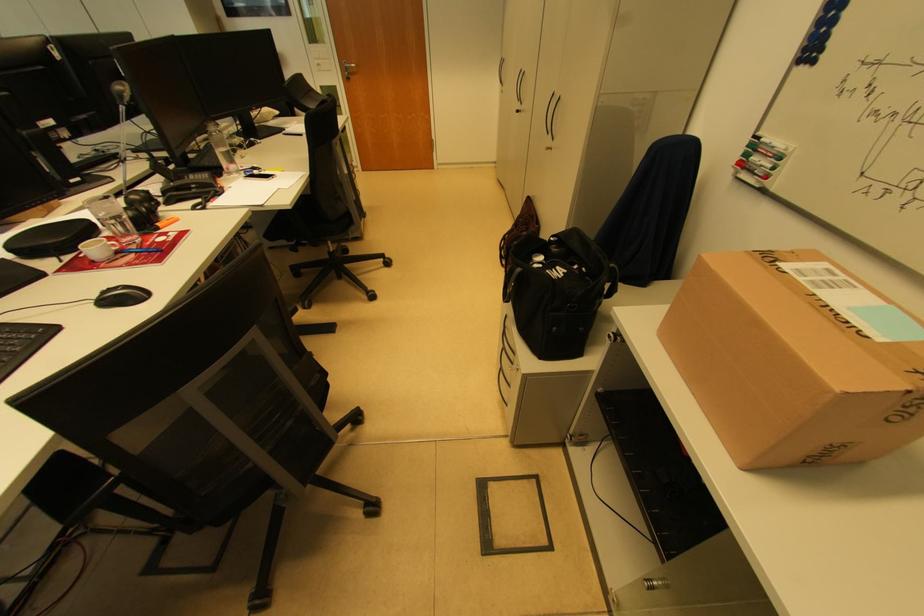
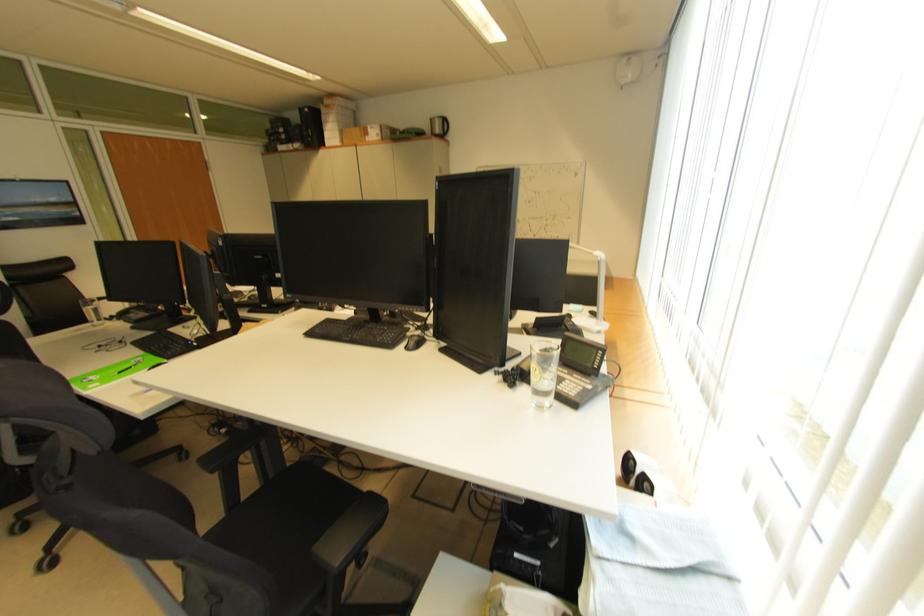
Question: I am providing you with two images of the same scene from different viewpoints. After the viewpoint changes to image2, which objects are now occluded?

Choices:
 (A) stacked paper items
 (B) clear drinking glass
 (C) phone handset
 (D) black chair armrest

Answer: (B)